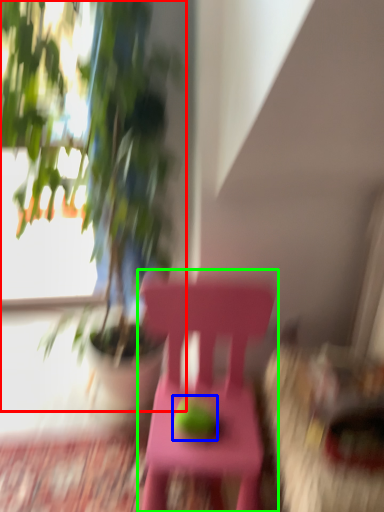
Question: Which object is positioned farthest from houseplant (highlighted by a red box)? Select from fruit (highlighted by a blue box) and chair (highlighted by a green box).

Choices:
 (A) fruit
 (B) chair

Answer: (A)